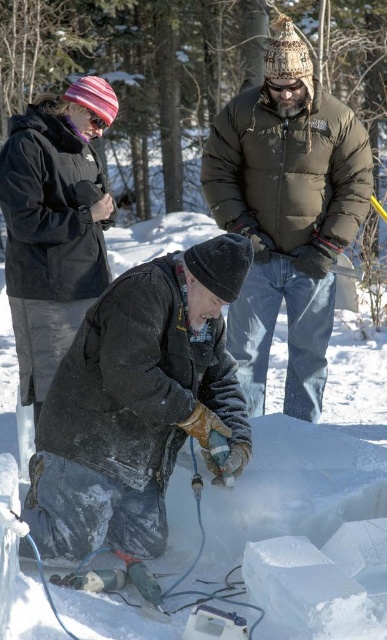
Describe the element at coordinates (138, 403) in the screenshot. The width and height of the screenshot is (387, 640). I see `dark brown leather gloves at center` at that location.

Between dark brown leather gloves at center and white frosty snow at center, which one appears on the left side from the viewer's perspective?

white frosty snow at center is more to the left.

Who is more forward, (172, 433) or (94, 634)?

Point (94, 634) is more forward.

Where is `dark brown leather gloves at center`? This screenshot has height=640, width=387. dark brown leather gloves at center is located at coordinates (138, 403).

Is dark brown leather gloves at center taller than dark green puffy jacket at center?

No.

Describe the element at coordinates (138, 403) in the screenshot. The width and height of the screenshot is (387, 640). I see `dark brown leather gloves at center` at that location.

Is point (111, 452) positioned after point (304, 321)?

No, (111, 452) is closer to viewer.

Image resolution: width=387 pixels, height=640 pixels. In order to click on dark brown leather gloves at center in this screenshot , I will do pyautogui.click(x=138, y=403).

Does white frosty snow at center have a greater width compared to dark green puffy jacket at center?

Incorrect, white frosty snow at center's width does not surpass dark green puffy jacket at center's.

Does white frosty snow at center appear under dark green puffy jacket at center?

Yes, white frosty snow at center is below dark green puffy jacket at center.

Between point (361, 627) and point (231, 166), which one is positioned behind?

Point (231, 166)

Identify the location of white frosty snow at center. (306, 451).